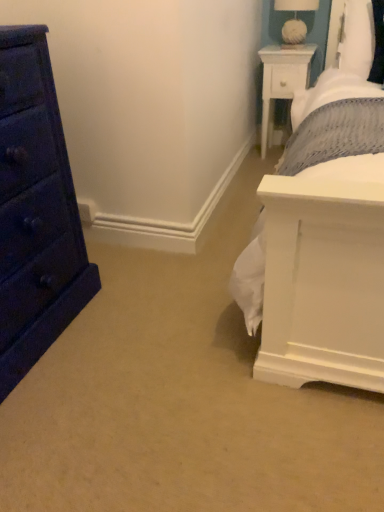
Question: Is white wood nightstand at upper right far from matte dark blue dresser at left?

Choices:
 (A) no
 (B) yes

Answer: (B)

Question: From the image's perspective, is white wood nightstand at upper right under matte dark blue dresser at left?

Choices:
 (A) no
 (B) yes

Answer: (A)

Question: Considering the relative sizes of white wood nightstand at upper right and matte dark blue dresser at left in the image provided, is white wood nightstand at upper right bigger than matte dark blue dresser at left?

Choices:
 (A) yes
 (B) no

Answer: (B)

Question: Considering the relative sizes of white wood nightstand at upper right and matte dark blue dresser at left in the image provided, is white wood nightstand at upper right wider than matte dark blue dresser at left?

Choices:
 (A) no
 (B) yes

Answer: (A)

Question: Is white wood nightstand at upper right positioned beyond the bounds of matte dark blue dresser at left?

Choices:
 (A) yes
 (B) no

Answer: (A)

Question: Is white fabric-covered lampshade at upper right bigger or smaller than white wood nightstand at upper right?

Choices:
 (A) small
 (B) big

Answer: (A)

Question: From a real-world perspective, is white fabric-covered lampshade at upper right above or below white wood nightstand at upper right?

Choices:
 (A) above
 (B) below

Answer: (A)

Question: Relative to white wood nightstand at upper right, is white fabric-covered lampshade at upper right in front or behind?

Choices:
 (A) front
 (B) behind

Answer: (A)

Question: Considering the positions of point (294, 31) and point (301, 49), is point (294, 31) closer or farther from the camera than point (301, 49)?

Choices:
 (A) farther
 (B) closer

Answer: (B)

Question: Visually, is white wood nightstand at upper right positioned to the left or to the right of matte dark blue dresser at left?

Choices:
 (A) left
 (B) right

Answer: (B)

Question: Is white wood nightstand at upper right bigger or smaller than matte dark blue dresser at left?

Choices:
 (A) small
 (B) big

Answer: (A)

Question: Is white wood nightstand at upper right situated inside matte dark blue dresser at left or outside?

Choices:
 (A) outside
 (B) inside

Answer: (A)

Question: Considering the positions of white wood nightstand at upper right and matte dark blue dresser at left in the image, is white wood nightstand at upper right wider or thinner than matte dark blue dresser at left?

Choices:
 (A) thin
 (B) wide

Answer: (A)

Question: Relative to white fabric-covered lampshade at upper right, is matte dark blue dresser at left in front or behind?

Choices:
 (A) front
 (B) behind

Answer: (A)

Question: Is matte dark blue dresser at left wider or thinner than white fabric-covered lampshade at upper right?

Choices:
 (A) wide
 (B) thin

Answer: (A)